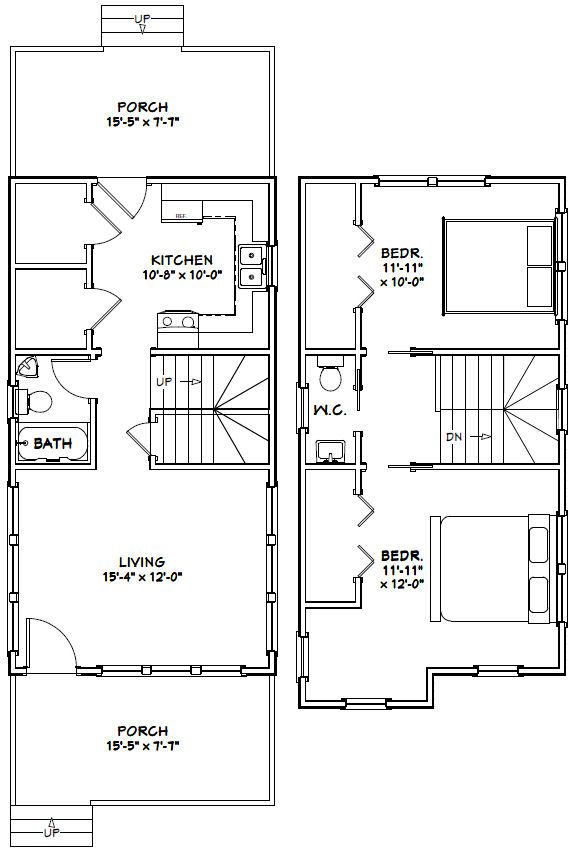
Find the location of a particular element. The height and width of the screenshot is (856, 575). windows on lower level is located at coordinates click(x=12, y=579), click(x=271, y=568), click(x=168, y=669), click(x=274, y=265), click(x=7, y=396).